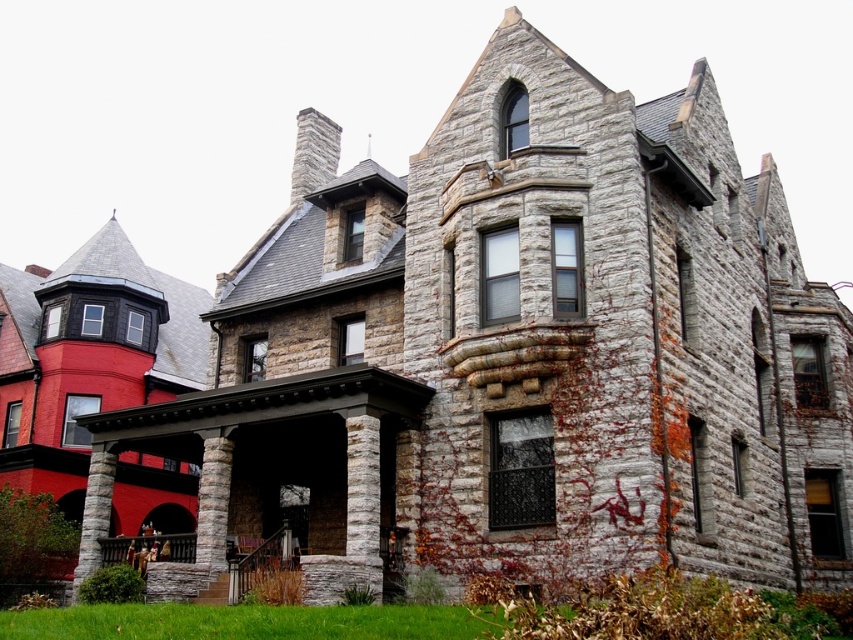
Which of these two, stone porch at lower center or gray stone column at lower left, stands taller?

gray stone column at lower left is taller.

Between point (234, 572) and point (102, 492), which one is positioned behind?

The point (102, 492) is more distant.

This screenshot has width=853, height=640. What are the coordinates of `stone porch at lower center` in the screenshot? It's located at (263, 561).

Measure the distance between stone textured column at center and gray stone column at lower left.

stone textured column at center is 7.88 meters from gray stone column at lower left.

Between stone textured column at center and gray stone column at lower left, which one has less height?

With less height is gray stone column at lower left.

Is point (210, 476) positioned after point (100, 451)?

No.

Find the location of a particular element. Image resolution: width=853 pixels, height=640 pixels. stone textured column at center is located at coordinates (213, 502).

Who is positioned more to the right, stone porch at lower center or stone textured column at center?

stone porch at lower center

Is point (241, 582) more distant than point (212, 490)?

That is False.

Does point (142, 538) come behind point (206, 476)?

That is True.

At what (x,y) coordinates should I click in order to perform the action: click on stone porch at lower center. Please return your answer as a coordinate pair (x, y). This screenshot has width=853, height=640. Looking at the image, I should click on (263, 561).